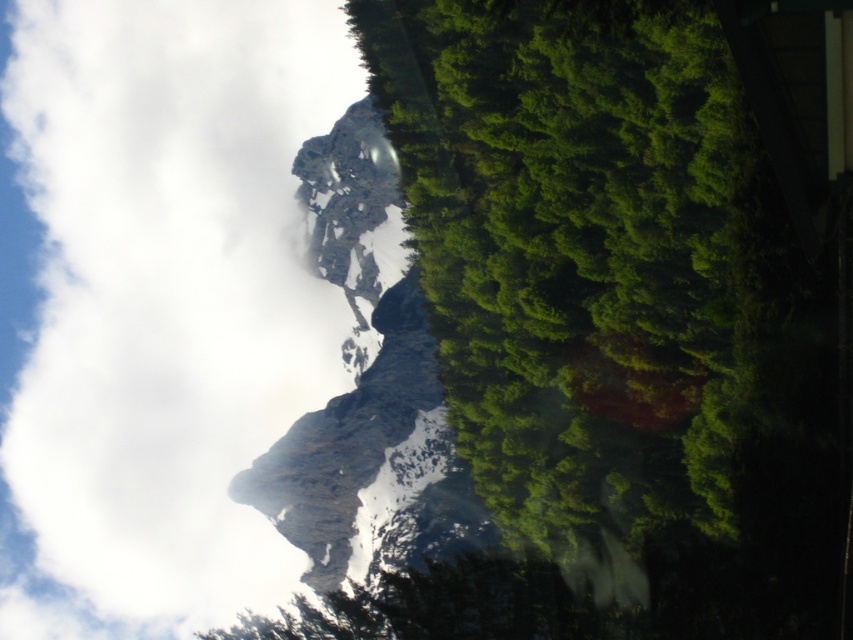
Question: Which point appears closest to the camera in this image?

Choices:
 (A) (202, 244)
 (B) (614, 298)

Answer: (B)

Question: Does white fluffy cloud at upper left have a larger size compared to green leafy tree at center?

Choices:
 (A) yes
 (B) no

Answer: (A)

Question: Does white fluffy cloud at upper left appear on the right side of green leafy tree at center?

Choices:
 (A) yes
 (B) no

Answer: (B)

Question: Does white fluffy cloud at upper left have a larger size compared to green leafy tree at center?

Choices:
 (A) yes
 (B) no

Answer: (A)

Question: Which object is farther from the camera taking this photo?

Choices:
 (A) white fluffy cloud at upper left
 (B) green leafy tree at center

Answer: (A)